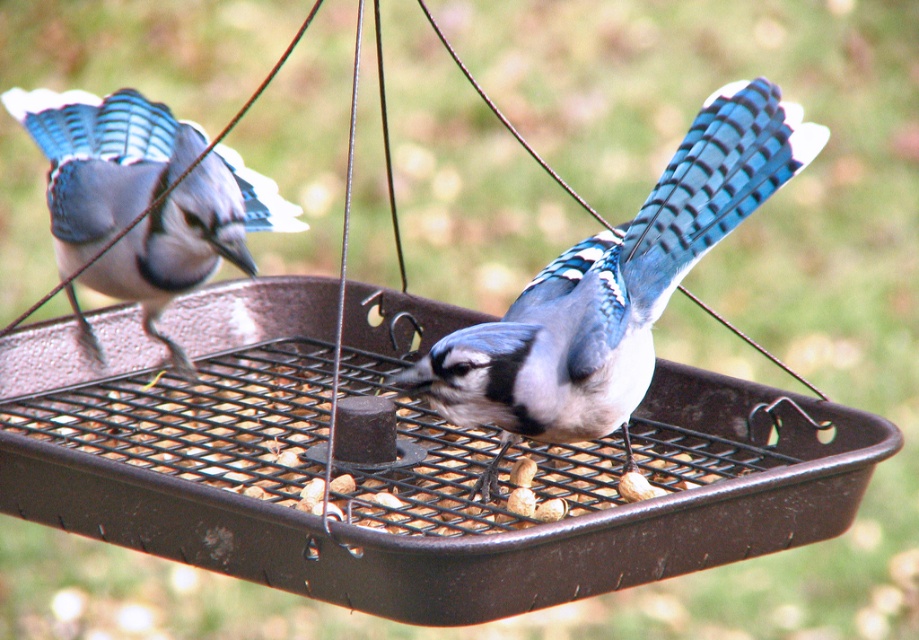
Who is more forward, (730,164) or (284,202)?

Point (730,164)

Can you confirm if blue glossy feathers at center is positioned to the right of matte blue feathers at left?

Yes, blue glossy feathers at center is to the right of matte blue feathers at left.

Between point (582, 323) and point (108, 102), which one is positioned in front?

Point (582, 323) is in front.

What are the coordinates of `blue glossy feathers at center` in the screenshot? It's located at [x=614, y=289].